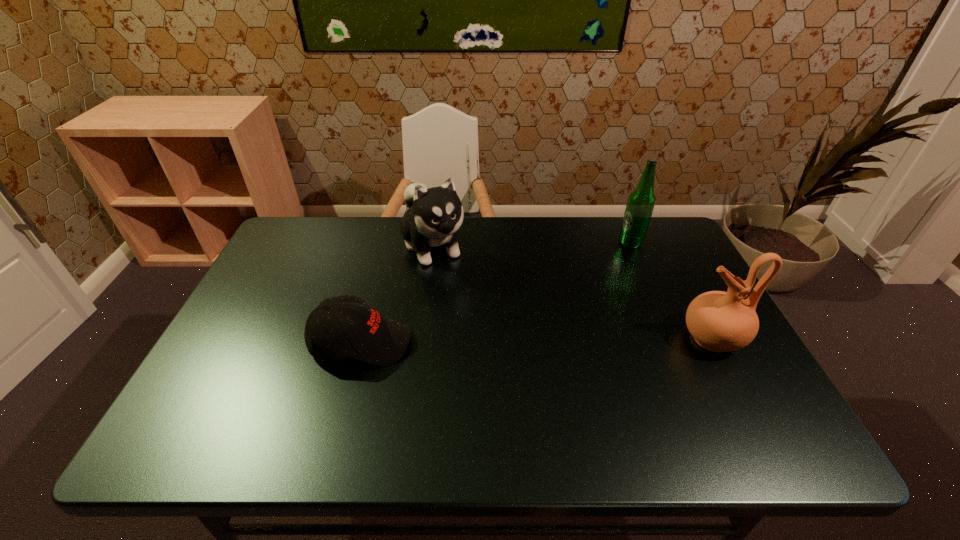
You are a GUI agent. You are given a task and a screenshot of the screen. Output one action in this format:
    pyautogui.click(x=<x>, y=<y>)
    Task: Click on the vacant area between the shortest object and the puppy
    
    Given the screenshot: What is the action you would take?
    pyautogui.click(x=397, y=294)

Where is `free space that is in between the beer bottle and the baseball cap`? The image size is (960, 540). free space that is in between the beer bottle and the baseball cap is located at coordinates (496, 293).

Identify the location of vacant area that lies between the pottery and the beer bottle. This screenshot has height=540, width=960. (671, 291).

The width and height of the screenshot is (960, 540). In order to click on unoccupied area between the beer bottle and the pottery in this screenshot , I will do `click(671, 291)`.

Locate an element on the screen. This screenshot has width=960, height=540. vacant space that is in between the baseball cap and the pottery is located at coordinates (537, 340).

The width and height of the screenshot is (960, 540). In order to click on the closest object to the puppy in this screenshot , I will do `click(372, 338)`.

Where is `object that is the third closest to the baseball cap`? object that is the third closest to the baseball cap is located at coordinates (641, 201).

I want to click on free space that satisfies the following two spatial constraints: 1. on the front side of the pottery; 2. on the spout of the puppy, so click(x=421, y=339).

This screenshot has height=540, width=960. I want to click on free region that satisfies the following two spatial constraints: 1. on the front side of the pottery; 2. on the spout of the beer bottle, so click(672, 339).

At what (x,y) coordinates should I click in order to perform the action: click on vacant space that satisfies the following two spatial constraints: 1. on the front side of the pottery; 2. on the spout of the beer bottle. Please return your answer as a coordinate pair (x, y). This screenshot has width=960, height=540. Looking at the image, I should click on (672, 339).